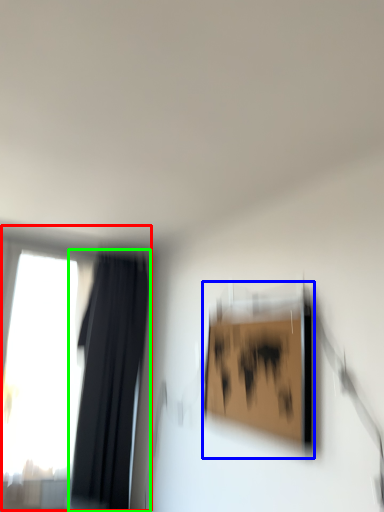
Question: Based on their relative distances, which object is nearer to window (highlighted by a red box)? Choose from picture frame (highlighted by a blue box) and curtain (highlighted by a green box).

Choices:
 (A) picture frame
 (B) curtain

Answer: (B)